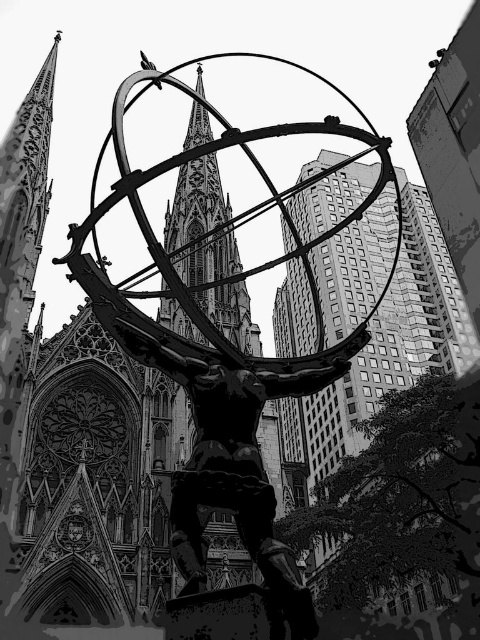
You are an architect designing a new plaza and want to place a bench between the metallic statue at center and the smooth stone spire at center. Given that the bench requires 1.2 meters of space, can the available space between them accommodate the bench?

The metallic statue at center is wider than the smooth stone spire at center, so the space between them is sufficient to place a bench requiring 1.2 meters of space.

You are an architect planning to install a new 10 meter wide decorative archway between the metallic statue at center and the smooth stone spire at center. Based on their current distance, will the archway fit between them without overlapping either structure?

The metallic statue at center and smooth stone spire at center are 11.59 meters apart. Since the archway is 10 meters wide, it will fit between them with 1.59 meters of space remaining on either side.

You are standing in front of the image and want to locate the metallic statue at center. According to the coordinates provided, where exactly is it positioned?

The metallic statue at center is located at point coordinates 0.559 along the x axis and 0.465 along the y axis.